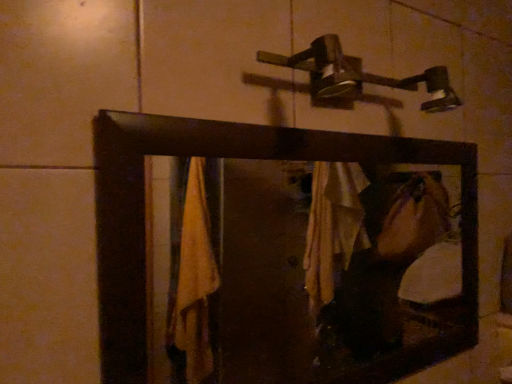
Question: Is metallic silver shower at upper center outside wooden frame mirror at center?

Choices:
 (A) yes
 (B) no

Answer: (A)

Question: From the image's perspective, is metallic silver shower at upper center on wooden frame mirror at center?

Choices:
 (A) yes
 (B) no

Answer: (A)

Question: Considering the relative positions of metallic silver shower at upper center and wooden frame mirror at center in the image provided, is metallic silver shower at upper center to the right of wooden frame mirror at center from the viewer's perspective?

Choices:
 (A) no
 (B) yes

Answer: (B)

Question: Considering the relative sizes of metallic silver shower at upper center and wooden frame mirror at center in the image provided, is metallic silver shower at upper center thinner than wooden frame mirror at center?

Choices:
 (A) no
 (B) yes

Answer: (A)

Question: Is metallic silver shower at upper center looking in the opposite direction of wooden frame mirror at center?

Choices:
 (A) no
 (B) yes

Answer: (A)

Question: Is metallic silver shower at upper center next to wooden frame mirror at center and touching it?

Choices:
 (A) yes
 (B) no

Answer: (B)

Question: Is wooden frame mirror at center turned away from metallic silver shower at upper center?

Choices:
 (A) no
 (B) yes

Answer: (A)

Question: Is wooden frame mirror at center outside of metallic silver shower at upper center?

Choices:
 (A) no
 (B) yes

Answer: (B)

Question: Considering the relative positions of wooden frame mirror at center and metallic silver shower at upper center in the image provided, is wooden frame mirror at center behind metallic silver shower at upper center?

Choices:
 (A) yes
 (B) no

Answer: (B)

Question: Does wooden frame mirror at center come in front of metallic silver shower at upper center?

Choices:
 (A) yes
 (B) no

Answer: (A)

Question: Is wooden frame mirror at center bigger than metallic silver shower at upper center?

Choices:
 (A) no
 (B) yes

Answer: (B)

Question: Is wooden frame mirror at center wider than metallic silver shower at upper center?

Choices:
 (A) no
 (B) yes

Answer: (A)

Question: Relative to metallic silver shower at upper center, is wooden frame mirror at center in front or behind?

Choices:
 (A) behind
 (B) front

Answer: (B)